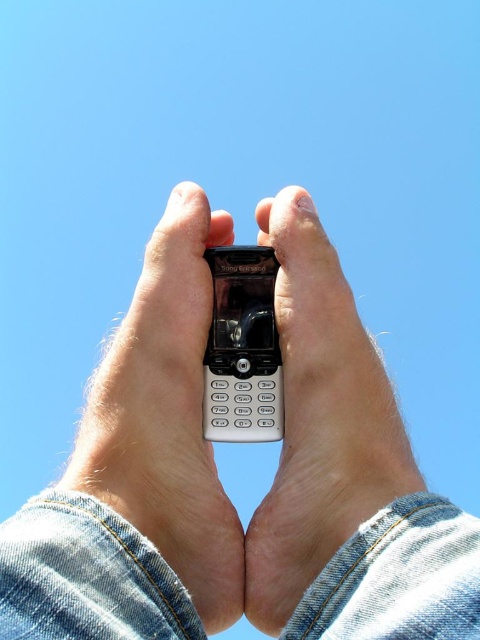
You are a photographer trying to capture a closeup of the phone held by the two hands. You notice two points marked in the image at coordinates point (460,611) and point (222,416). Which point should you focus on to ensure the phone is sharp in the photo?

Point (460,611) is in front of point (222,416), so focusing on point (460,611) will ensure the phone is sharp since it is closer to the camera.

You are trying to decide which phone to choose between the white plastic phone at center and the matte black phone at center. If you prefer a wider phone, which one should you pick?

The white plastic phone at center is wider than the matte black phone at center, so you should choose the white plastic phone at center if you prefer a wider phone.